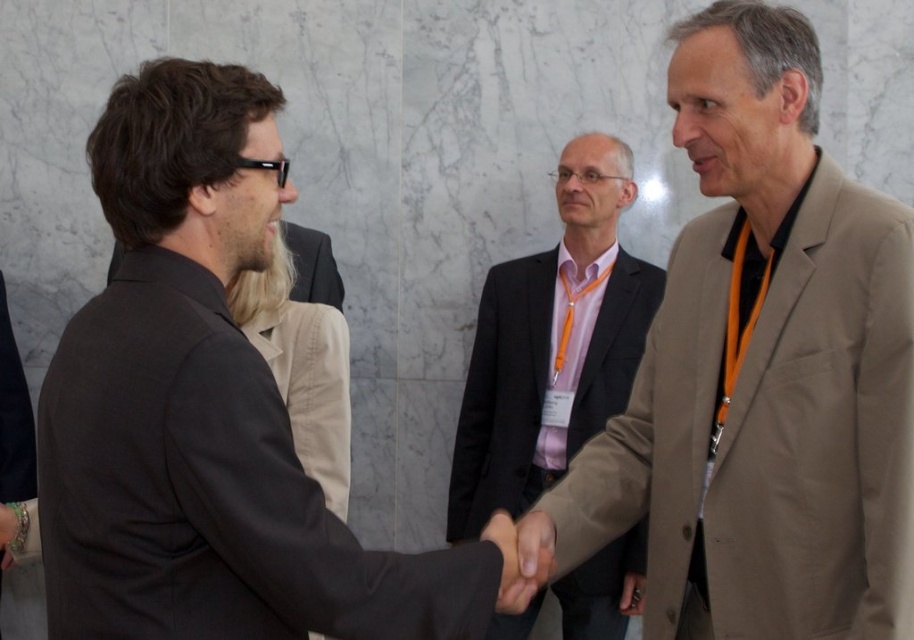
You are organizing a seating arrangement for a conference dinner and need to seat two guests wearing a beige fabric suit at right and a dark gray suit at center. If the table has limited space, which guest should you seat first to accommodate their size?

The beige fabric suit at right is bigger than the dark gray suit at center, so you should seat the guest in the beige fabric suit at right first to ensure there is enough space for their larger size.

You are attending a conference and need to locate two individuals based on their attire. You see the beige fabric suit at right and the dark gray suit at center. Which one is positioned higher in the image?

The beige fabric suit at right is located above the dark gray suit at center, so it is positioned higher in the image.